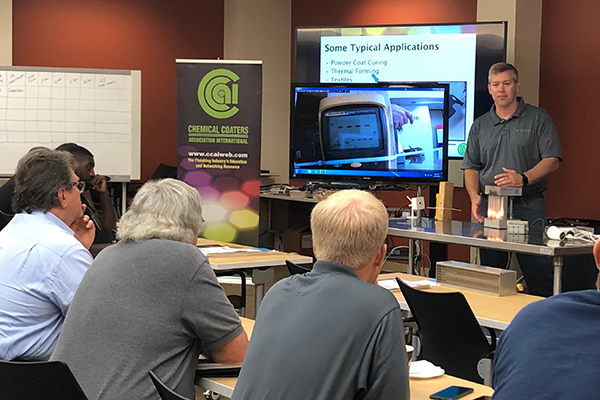
The height and width of the screenshot is (400, 600). Find the location of `tv`. tv is located at coordinates (413, 128).